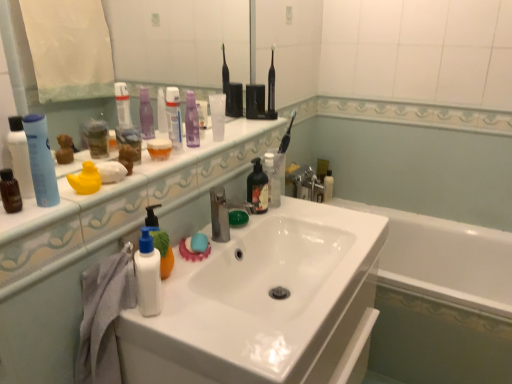
What are the coordinates of `free space to the right of translucent plastic bottle at center, arranged as the 1th toiletry when viewed from the right` in the screenshot? It's located at (311, 210).